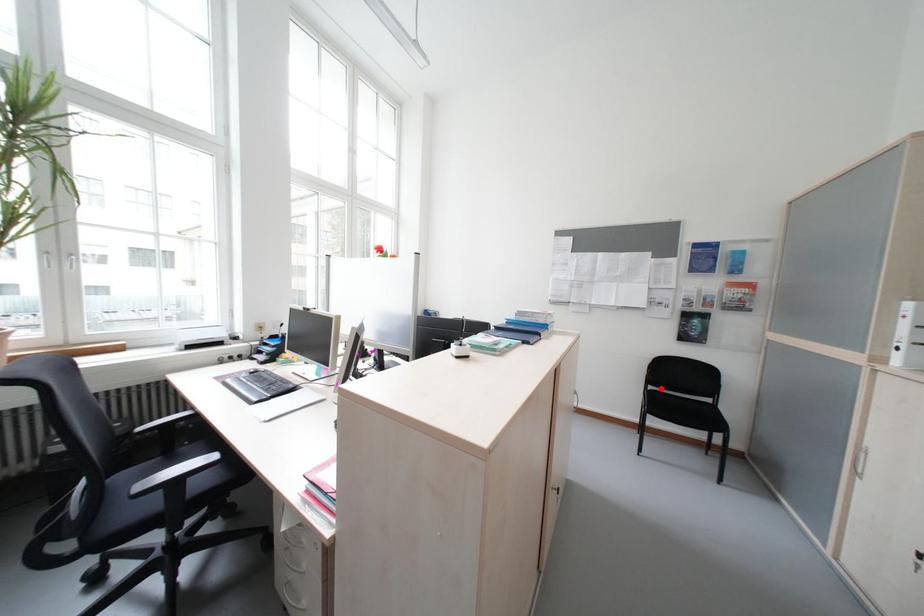
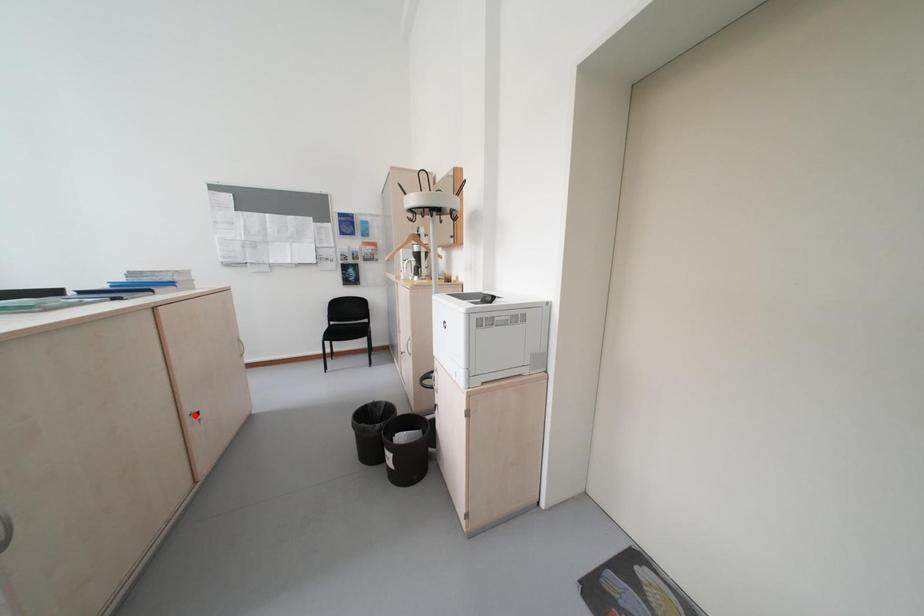
I am providing you with two images of the same scene from different viewpoints. A red point is marked on the first image and another point is marked on the second image. Does the point marked in image1 correspond to the same location as the one in image2?

No